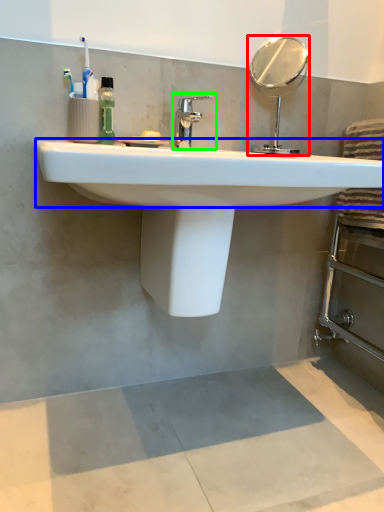
Question: Based on their relative distances, which object is farther from mirror (highlighted by a red box)? Choose from counter top (highlighted by a blue box) and tap (highlighted by a green box).

Choices:
 (A) counter top
 (B) tap

Answer: (A)